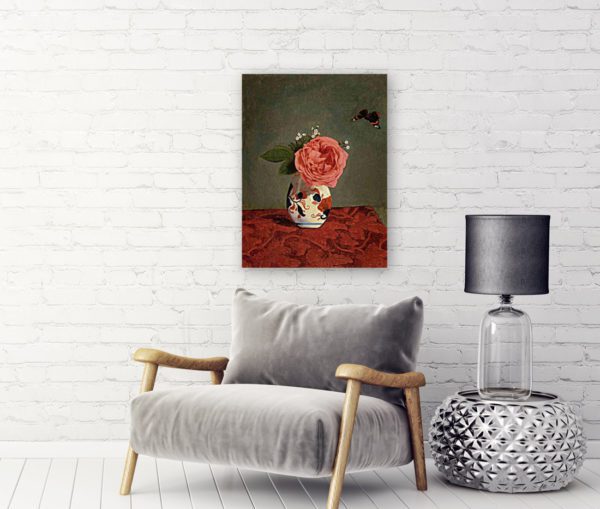
This screenshot has width=600, height=509. What are the coordinates of `right wooden chair arm` in the screenshot? It's located at (368, 378).